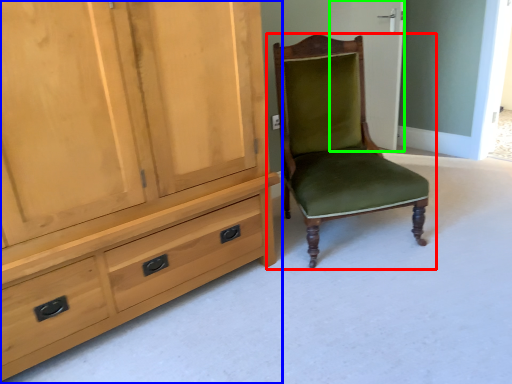
Question: Which is farther away from chair (highlighted by a red box)? cabinetry (highlighted by a blue box) or screen door (highlighted by a green box)?

Choices:
 (A) cabinetry
 (B) screen door

Answer: (B)